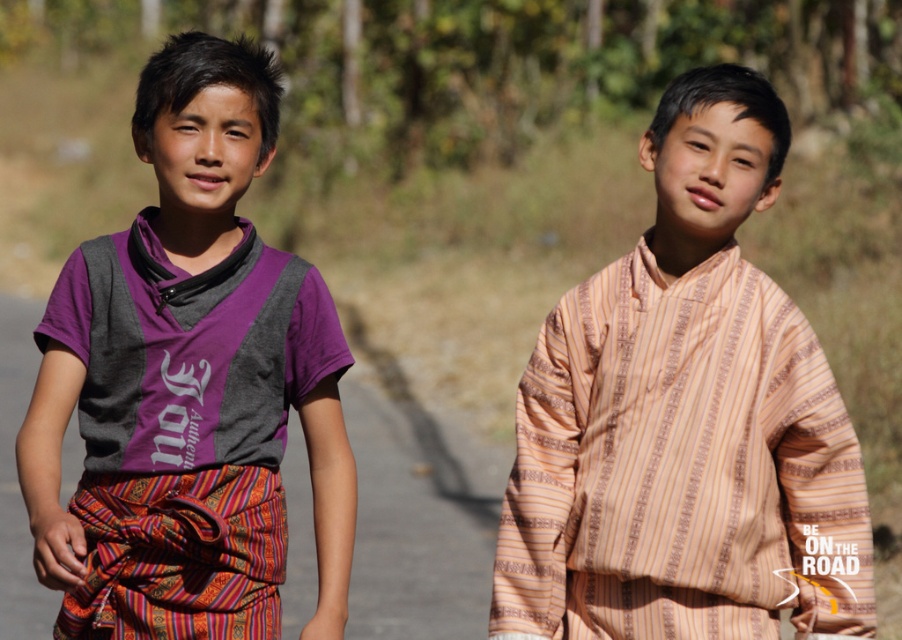
Question: Is striped cotton shirt at center to the left of purple cotton shirt at center from the viewer's perspective?

Choices:
 (A) yes
 (B) no

Answer: (B)

Question: Among these objects, which one is nearest to the camera?

Choices:
 (A) striped cotton shirt at center
 (B) purple cotton shirt at center

Answer: (B)

Question: From the image, what is the correct spatial relationship of striped cotton shirt at center in relation to purple cotton shirt at center?

Choices:
 (A) left
 (B) right

Answer: (B)

Question: Considering the relative positions of striped cotton shirt at center and purple cotton shirt at center in the image provided, where is striped cotton shirt at center located with respect to purple cotton shirt at center?

Choices:
 (A) right
 (B) left

Answer: (A)